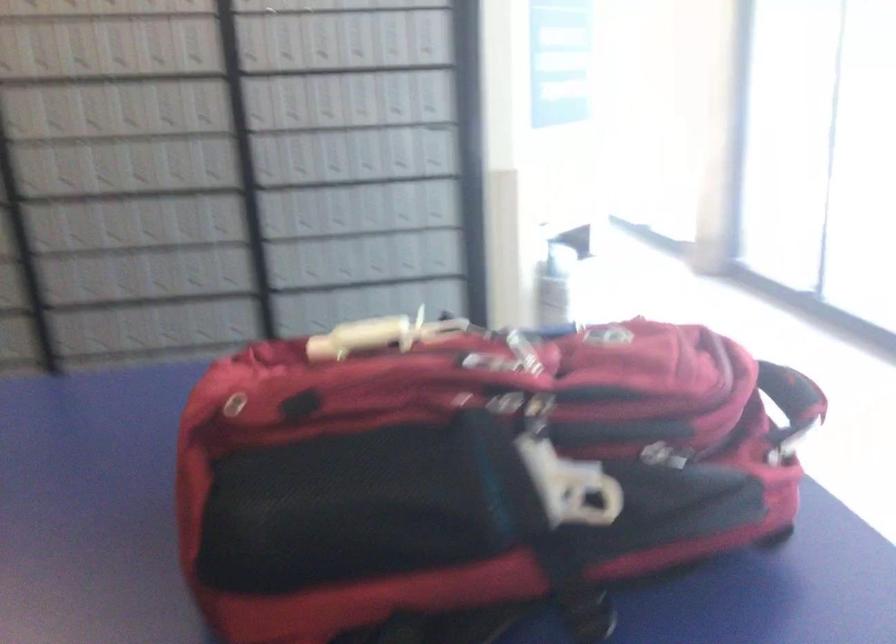
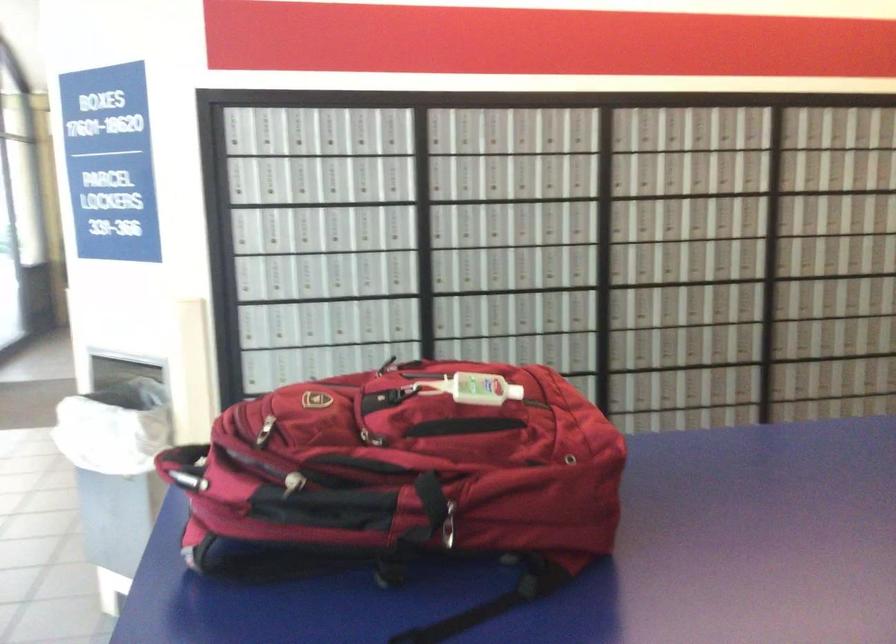
The point at [554,337] is marked in the first image. Where is the corresponding point in the second image?

(293, 483)